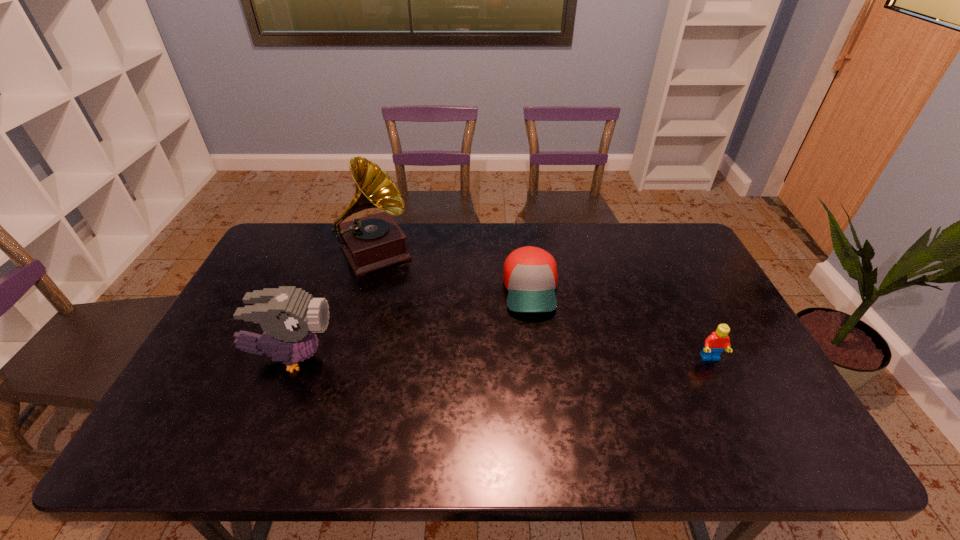
Identify the location of free space between the bird and the second object from right to left. This screenshot has height=540, width=960. (411, 324).

This screenshot has width=960, height=540. Identify the location of free space between the third object from left to right and the bird. (411, 324).

Locate an element on the screen. This screenshot has height=540, width=960. object that is the third nearest to the third object from left to right is located at coordinates (289, 316).

Where is `object that is the third closest to the tallest object`? object that is the third closest to the tallest object is located at coordinates (715, 343).

At what (x,y) coordinates should I click in order to perform the action: click on vacant space that satisfies the following two spatial constraints: 1. on the front side of the baseball cap; 2. on the left side of the tallest object. Please return your answer as a coordinate pair (x, y). Looking at the image, I should click on (365, 289).